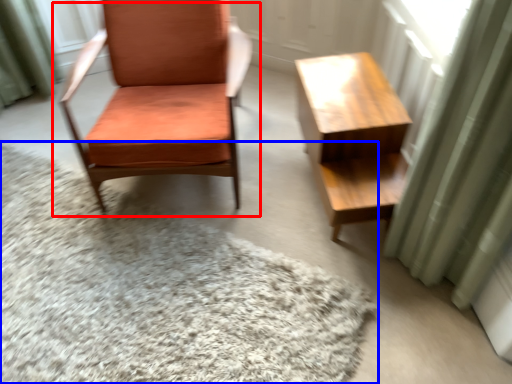
Question: Which point is further to the camera, chair (highlighted by a red box) or mat (highlighted by a blue box)?

Choices:
 (A) chair
 (B) mat

Answer: (A)